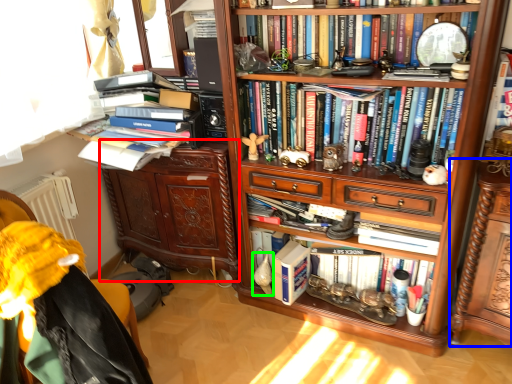
Question: Which is nearer to the cabinetry (highlighted by a red box)? shelf (highlighted by a blue box) or toy (highlighted by a green box).

Choices:
 (A) shelf
 (B) toy

Answer: (B)